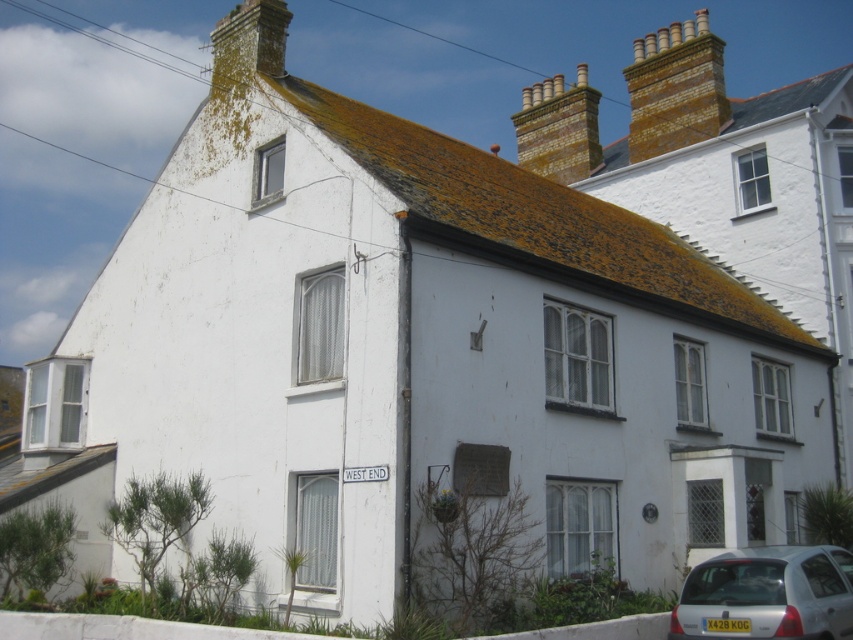
Question: Which object appears farthest from the camera in this image?

Choices:
 (A) silver metallic car at lower right
 (B) white painted brick cottage at upper right

Answer: (B)

Question: Does white painted brick cottage at upper right have a lesser width compared to silver metallic car at lower right?

Choices:
 (A) yes
 (B) no

Answer: (B)

Question: Is white painted brick cottage at upper right to the right of silver metallic car at lower right from the viewer's perspective?

Choices:
 (A) yes
 (B) no

Answer: (A)

Question: Which object appears closest to the camera in this image?

Choices:
 (A) silver metallic car at lower right
 (B) white painted brick cottage at upper right

Answer: (A)

Question: Which point is closer to the camera?

Choices:
 (A) white painted brick cottage at upper right
 (B) silver metallic car at lower right

Answer: (B)

Question: Is white painted brick cottage at upper right smaller than silver metallic car at lower right?

Choices:
 (A) no
 (B) yes

Answer: (A)